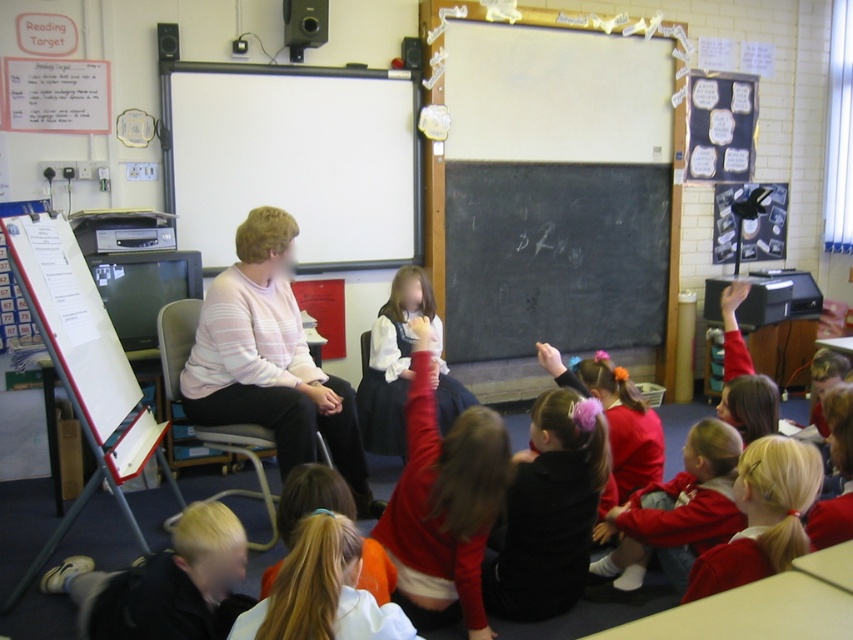
You are a student in the classroom and want to write something on the whiteboard at upper center. Based on its position, can you estimate where you should walk to reach it?

The whiteboard at upper center is located at point (294, 157), so you should walk towards the upper center area of the classroom to reach it.

You are a teacher in the classroom and want to hand out a small gift to the child with the red fleece jacket at lower right and the child with the blonde hair at lower center. If you have a gift box that is 15 cm wide, can both children hold their gifts side by side on the desk without overlapping?

The red fleece jacket at lower right is wider than the blonde hair at lower center. Since the gift box is 15 cm wide, but the total width of both gifts would depend on their individual sizes. However, the problem states that the red fleece jacket at lower right is wider than the blonde hair at lower center, but without specific measurements for each, we cannot determine if they fit within 15 cm. Therefore, it is uncertain if both can fit side by side without overlapping.

You are a student in the classroom. You notice the blonde hair at lower center and the white satin blouse at center. Which object is closer to the ground?

The blonde hair at lower center is closer to the ground because it is below the white satin blouse at center.